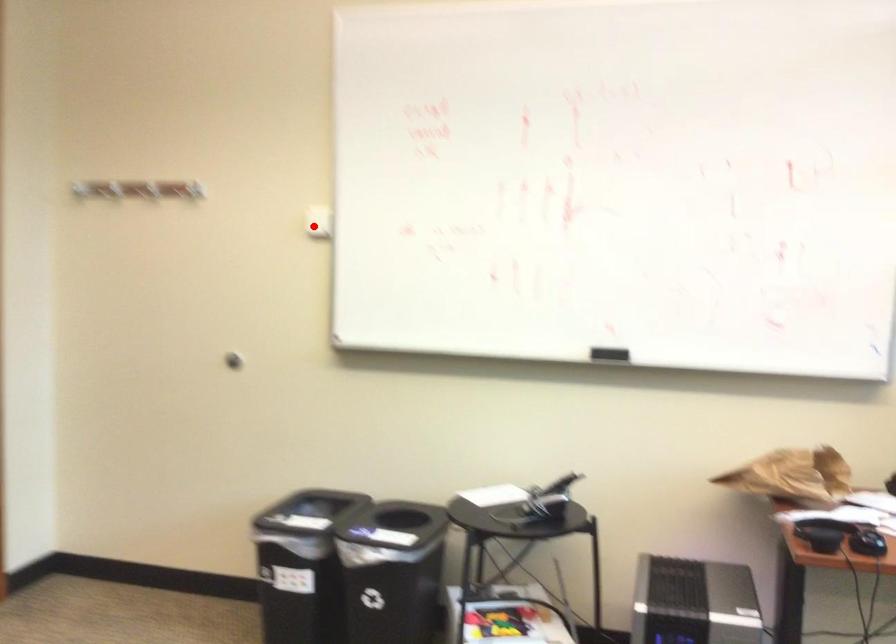
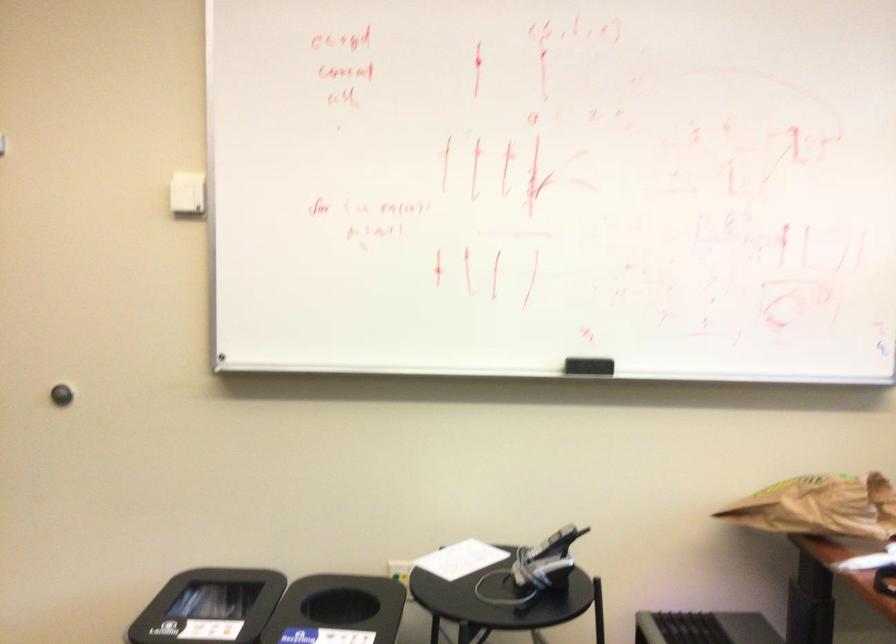
Question: A red point is marked in image1. In image2, is the corresponding 3D point closer to the camera or farther? Reply with the corresponding letter.

Choices:
 (A) The corresponding 3D point is closer.
 (B) The corresponding 3D point is farther.

Answer: (A)